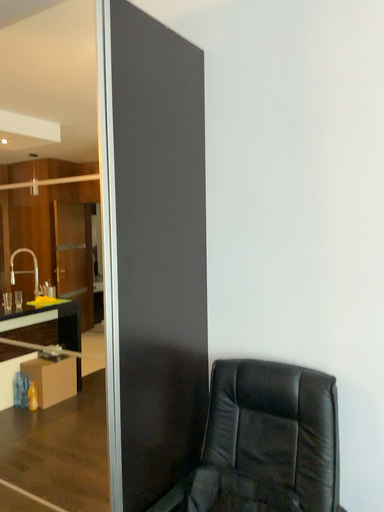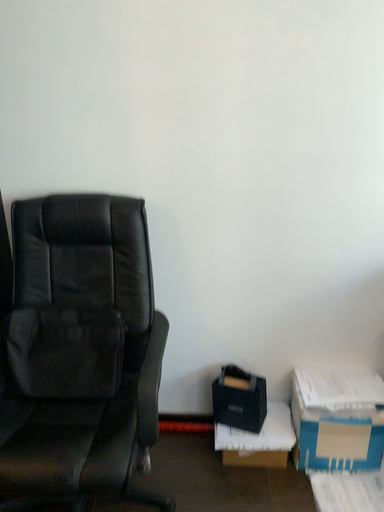
Question: Which way did the camera rotate in the video?

Choices:
 (A) rotated downward
 (B) rotated upward

Answer: (A)